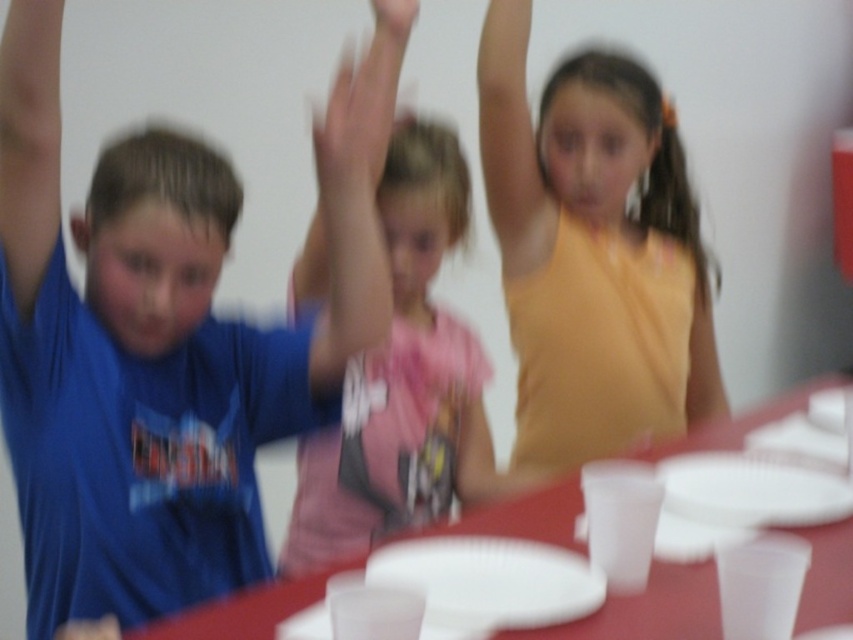
You are a photographer trying to capture a clear shot of the yellow matte tank top at upper center and the smooth skin hand at center. Based on their positions, which object should you focus on first to ensure both are in focus?

The yellow matte tank top at upper center is located below the smooth skin hand at center, so focusing on the smooth skin hand at center first would allow both objects to be in focus since it is closer to the camera.

You are a photographer trying to capture a clear shot of the yellow matte tank top at upper center and the white plastic plate at center. Based on the scene description, which object is closer to the camera?

The yellow matte tank top at upper center is closer to the camera because the white plastic plate at center is described as being behind it.

You are a photographer trying to capture a clear shot of the yellow matte tank top at upper center and the smooth skin hand at center. Based on their positions, which object should you focus on to ensure it appears larger in the photo?

The yellow matte tank top at upper center should be focused on because it is much taller than the smooth skin hand at center, making it naturally appear larger in the photo.